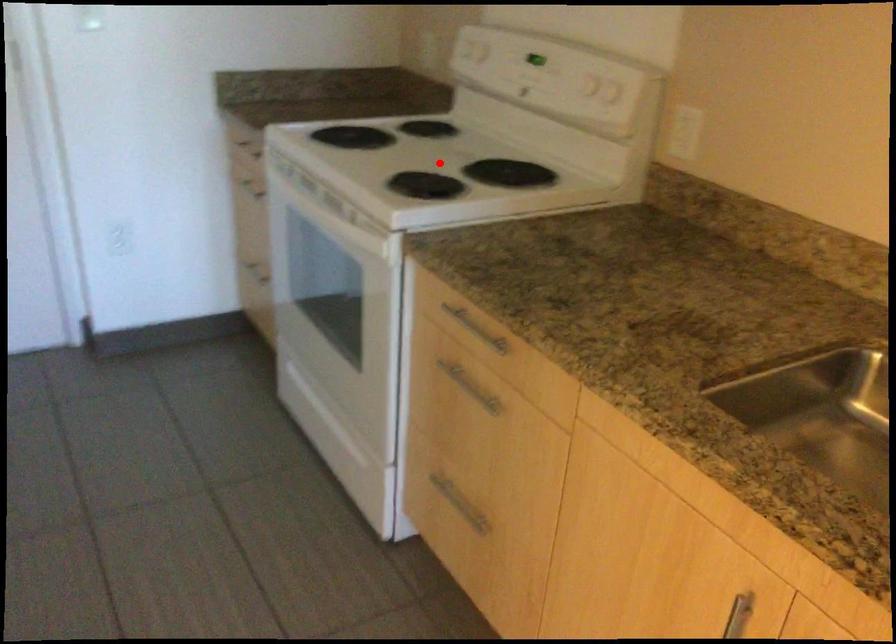
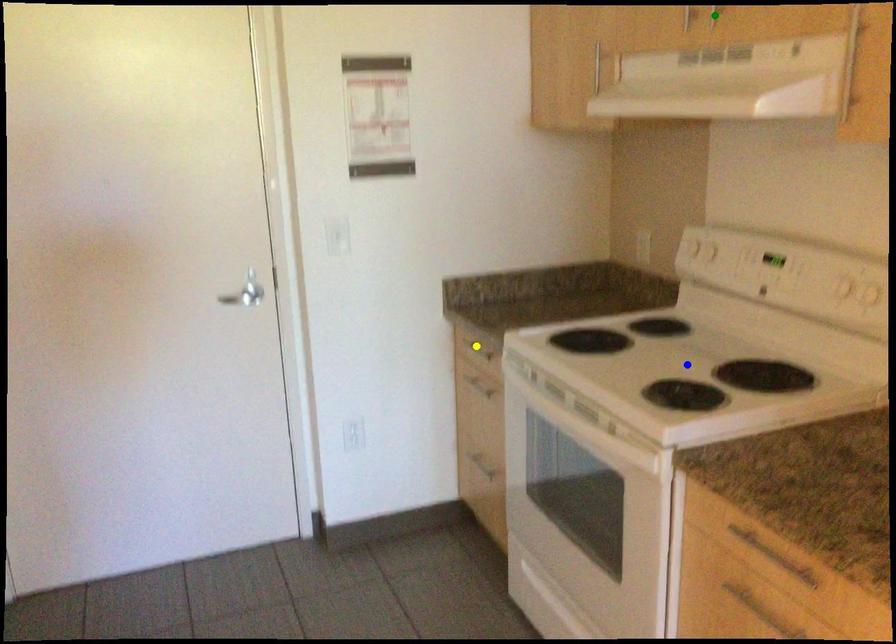
Question: I am providing you with two images of the same scene from different viewpoints. A red point is marked on the first image. You are given multiple points on the second image. Which point in image 2 is actually the same real-world point as the red point in image 1?

Choices:
 (A) blue point
 (B) yellow point
 (C) green point

Answer: (A)